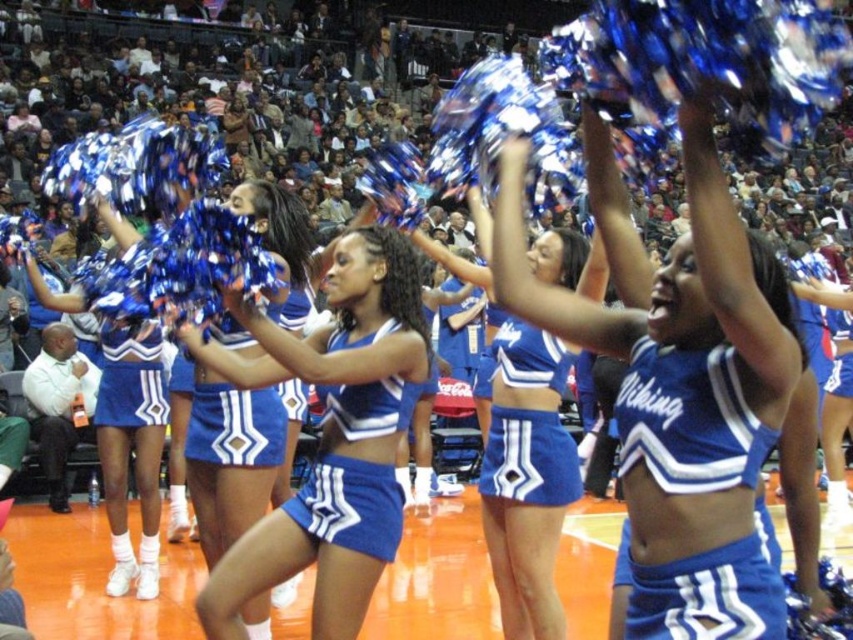
Question: Can you confirm if matte blue cheerleading outfit at center is thinner than matte blue uniform at center?

Choices:
 (A) no
 (B) yes

Answer: (A)

Question: In this image, where is blue shiny fabric cheerleading outfit at center located relative to matte blue uniform at center?

Choices:
 (A) left
 (B) right

Answer: (B)

Question: Does blue matte cheerleading uniform at center have a larger size compared to blue jersey at center?

Choices:
 (A) no
 (B) yes

Answer: (B)

Question: Which point is closer to the camera?

Choices:
 (A) blue jersey at center
 (B) blue matte cheerleading uniform at center

Answer: (B)

Question: Based on their relative distances, which object is farther from the blue jersey at center?

Choices:
 (A) blue shiny fabric cheerleading outfit at center
 (B) matte blue uniform at center

Answer: (B)

Question: Which of these objects is positioned farthest from the blue shiny pom-poms at upper center?

Choices:
 (A) blue matte cheerleading uniform at center
 (B) blue jersey at center

Answer: (B)